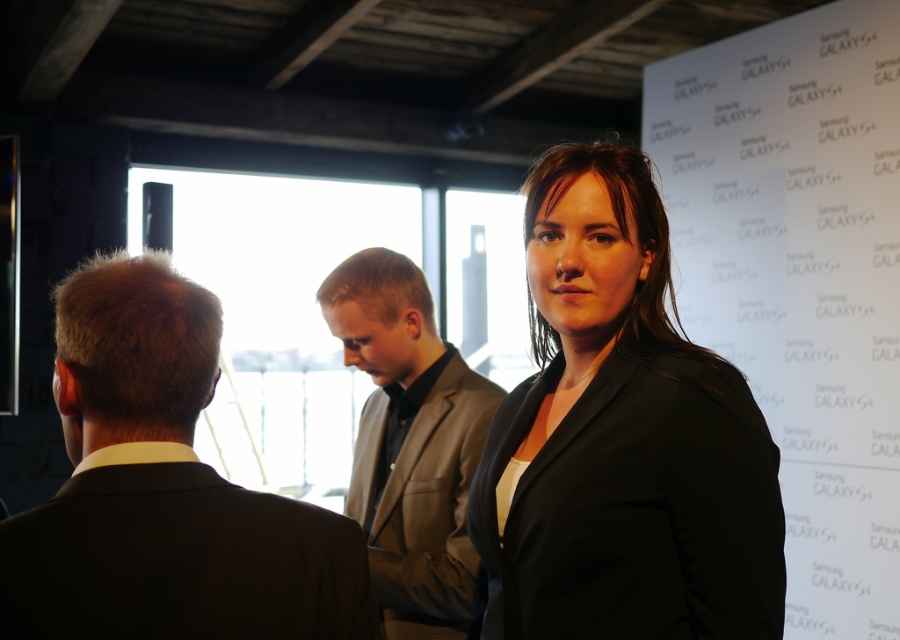
Question: Is black suit at left further to camera compared to gray matte suit at center?

Choices:
 (A) no
 (B) yes

Answer: (A)

Question: Is black suit at left to the right of gray matte suit at center from the viewer's perspective?

Choices:
 (A) no
 (B) yes

Answer: (A)

Question: Which of these objects is positioned farthest from the black matte blazer at center?

Choices:
 (A) black suit at left
 (B) gray matte suit at center

Answer: (B)

Question: Does black matte blazer at center come in front of black suit at left?

Choices:
 (A) no
 (B) yes

Answer: (A)

Question: Considering the real-world distances, which object is farthest from the black suit at left?

Choices:
 (A) black matte blazer at center
 (B) gray matte suit at center

Answer: (B)

Question: Among these objects, which one is farthest from the camera?

Choices:
 (A) gray matte suit at center
 (B) black suit at left

Answer: (A)